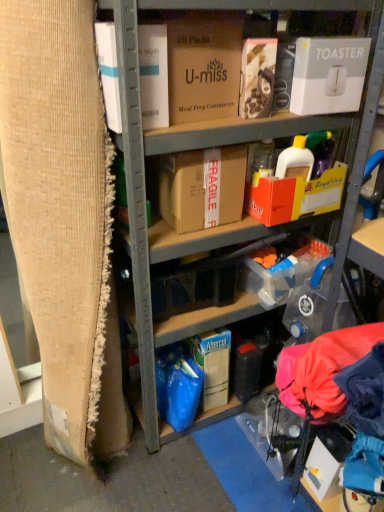
Question: Can you confirm if white cardboard box at upper left, which is the 4th box from right to left, is thinner than brown cardboard box at center, arranged as the 2th box when viewed from the right?

Choices:
 (A) yes
 (B) no

Answer: (A)

Question: Is white cardboard box at upper left, positioned as the 1th box in left-to-right order, aimed at brown cardboard box at center, which appears as the 3th box when viewed from the left?

Choices:
 (A) yes
 (B) no

Answer: (B)

Question: Does white cardboard box at upper left, which is the 4th box from right to left, have a larger size compared to brown cardboard box at center, arranged as the 2th box when viewed from the right?

Choices:
 (A) no
 (B) yes

Answer: (A)

Question: Is white cardboard box at upper left, which is the 4th box from right to left, located outside brown cardboard box at center, which appears as the 3th box when viewed from the left?

Choices:
 (A) no
 (B) yes

Answer: (B)

Question: From the image's perspective, does white cardboard box at upper left, positioned as the 1th box in left-to-right order, appear higher than brown cardboard box at center, which appears as the 3th box when viewed from the left?

Choices:
 (A) no
 (B) yes

Answer: (B)

Question: In terms of width, does white cardboard box at upper left, positioned as the 1th box in left-to-right order, look wider or thinner when compared to brown cardboard at left?

Choices:
 (A) thin
 (B) wide

Answer: (A)

Question: Is point (102, 53) closer or farther from the camera than point (105, 249)?

Choices:
 (A) closer
 (B) farther

Answer: (A)

Question: Looking at the image, does white cardboard box at upper left, which is the 4th box from right to left, seem bigger or smaller compared to brown cardboard at left?

Choices:
 (A) big
 (B) small

Answer: (B)

Question: Choose the correct answer: Is white cardboard box at upper left, which is the 4th box from right to left, inside brown cardboard at left or outside it?

Choices:
 (A) outside
 (B) inside

Answer: (A)

Question: Considering their positions, is blue plastic storage box at lower center located in front of or behind brown cardboard box at center, which appears as the 3th box when viewed from the left?

Choices:
 (A) behind
 (B) front

Answer: (A)

Question: Is blue plastic storage box at lower center wider or thinner than brown cardboard box at center, arranged as the 2th box when viewed from the right?

Choices:
 (A) thin
 (B) wide

Answer: (A)

Question: Is blue plastic storage box at lower center bigger or smaller than brown cardboard box at center, which appears as the 3th box when viewed from the left?

Choices:
 (A) big
 (B) small

Answer: (B)

Question: Is blue plastic storage box at lower center to the left or to the right of brown cardboard box at center, arranged as the 2th box when viewed from the right, in the image?

Choices:
 (A) right
 (B) left

Answer: (A)

Question: Is point (125, 48) positioned closer to the camera than point (175, 197)?

Choices:
 (A) farther
 (B) closer

Answer: (B)

Question: Considering their positions, is cardboard boxes at center located in front of or behind brown cardboard box at center, which appears as the 3th box when viewed from the left?

Choices:
 (A) front
 (B) behind

Answer: (A)